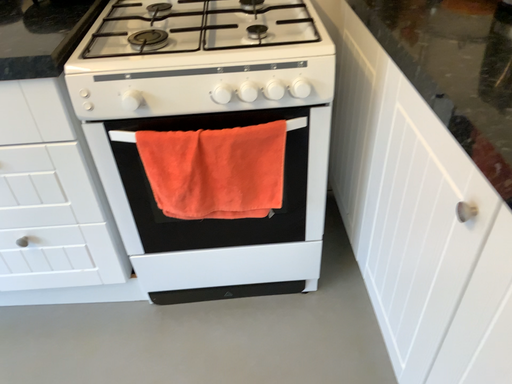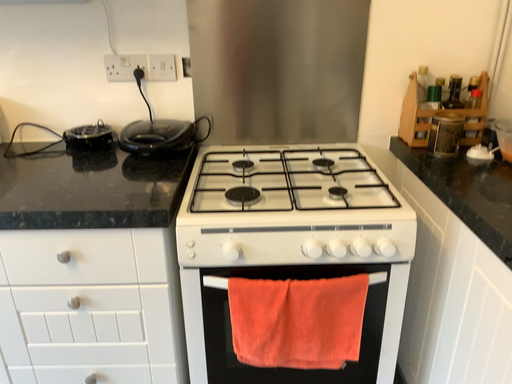
Question: How did the camera likely rotate when shooting the video?

Choices:
 (A) rotated downward
 (B) rotated upward

Answer: (B)